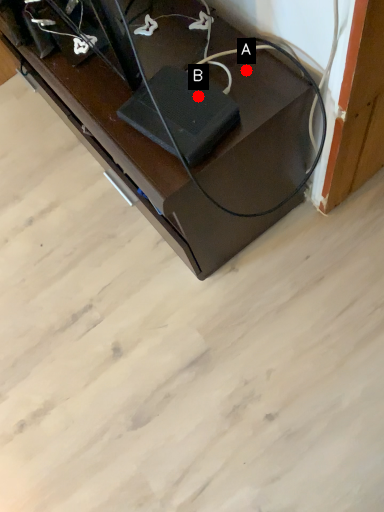
Question: Two points are circled on the image, labeled by A and B beside each circle. Which point is further to the camera?

Choices:
 (A) A is further
 (B) B is further

Answer: (A)